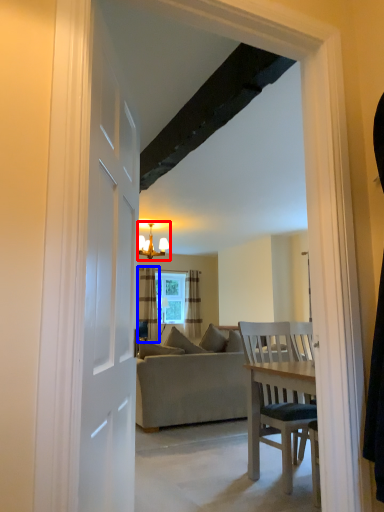
Question: Which point is further to the camera, light fixture (highlighted by a red box) or curtain (highlighted by a blue box)?

Choices:
 (A) light fixture
 (B) curtain

Answer: (B)